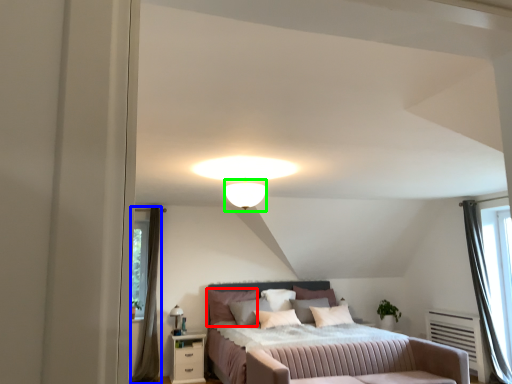
Question: Estimate the real-world distances between objects in this image. Which object is closer to pillow (highlighted by a red box), curtain (highlighted by a blue box) or lighting (highlighted by a green box)?

Choices:
 (A) curtain
 (B) lighting

Answer: (A)